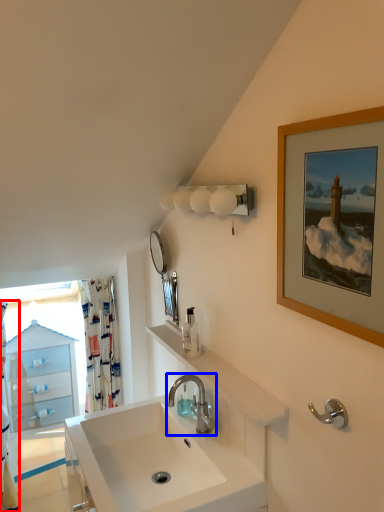
Question: Which point is further to the camera, shower curtain (highlighted by a red box) or tap (highlighted by a blue box)?

Choices:
 (A) shower curtain
 (B) tap

Answer: (A)